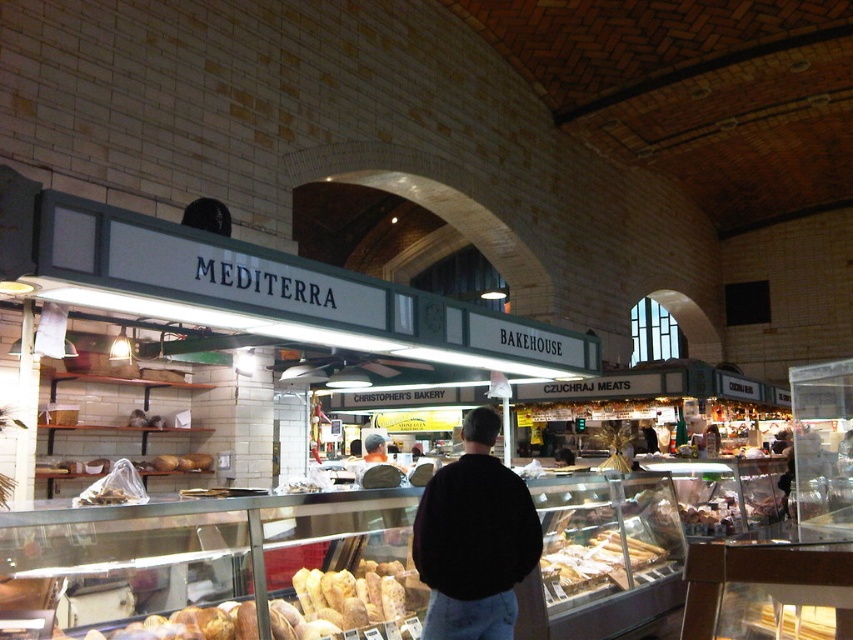
Question: Does golden crusty bread at center have a greater width compared to golden brown crusty bread at center?

Choices:
 (A) yes
 (B) no

Answer: (A)

Question: Can you confirm if black sweater at center is positioned below golden crusty bread at center?

Choices:
 (A) yes
 (B) no

Answer: (B)

Question: Is black sweater at center smaller than golden brown crusty bread at center?

Choices:
 (A) yes
 (B) no

Answer: (A)

Question: Which of the following is the closest to the observer?

Choices:
 (A) black sweater at center
 (B) golden crusty bread at center
 (C) golden brown crusty bread at center

Answer: (B)

Question: Which object is closer to the camera taking this photo?

Choices:
 (A) golden brown crusty bread at center
 (B) golden crusty bread at center
 (C) black sweater at center

Answer: (B)

Question: Which point is closer to the camera?

Choices:
 (A) (548, 550)
 (B) (415, 628)
 (C) (532, 561)

Answer: (C)